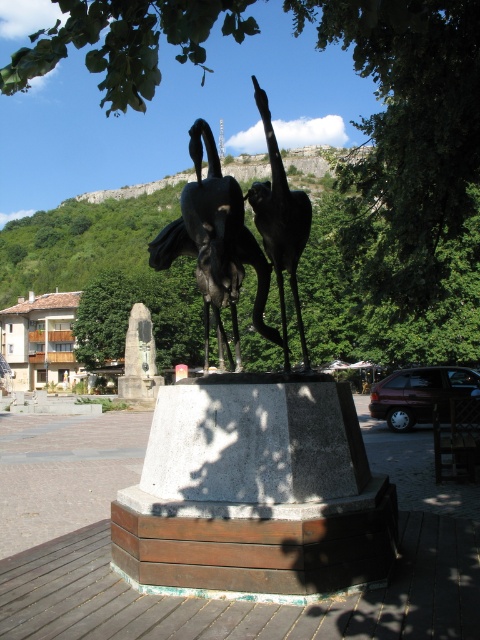
You are a photographer planning to capture a wide shot of the polished bronze birds at center. You want to ensure that the green leafy tree at upper center doesn not block the view of the birds. Based on the scene description, can you determine if the tree is wide enough to obstruct the birds?

The green leafy tree at upper center has a larger width than the polished bronze birds at center, so it is possible that the tree could obstruct the view of the birds depending on the angle and distance. However, since the tree is at the upper center and the birds are at the center, adjusting the camera angle slightly downward might help frame the birds without the tree blocking them.

You are a visitor to the town square and want to read the bronze plaque at center. However, there is a green leafy tree at upper center blocking your view. Can you move around the tree to see the plaque clearly?

The green leafy tree at upper center is in front of bronze plaque at center, so you cannot see the plaque clearly without moving around the tree. However, since the tree is at upper center, moving to either side might provide an unobstructed view.